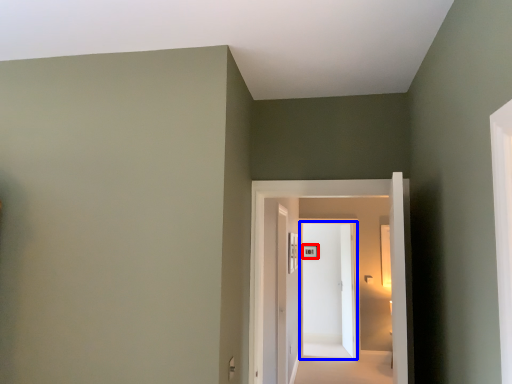
Question: Which point is closer to the camera, picture frame (highlighted by a red box) or door (highlighted by a blue box)?

Choices:
 (A) picture frame
 (B) door

Answer: (B)